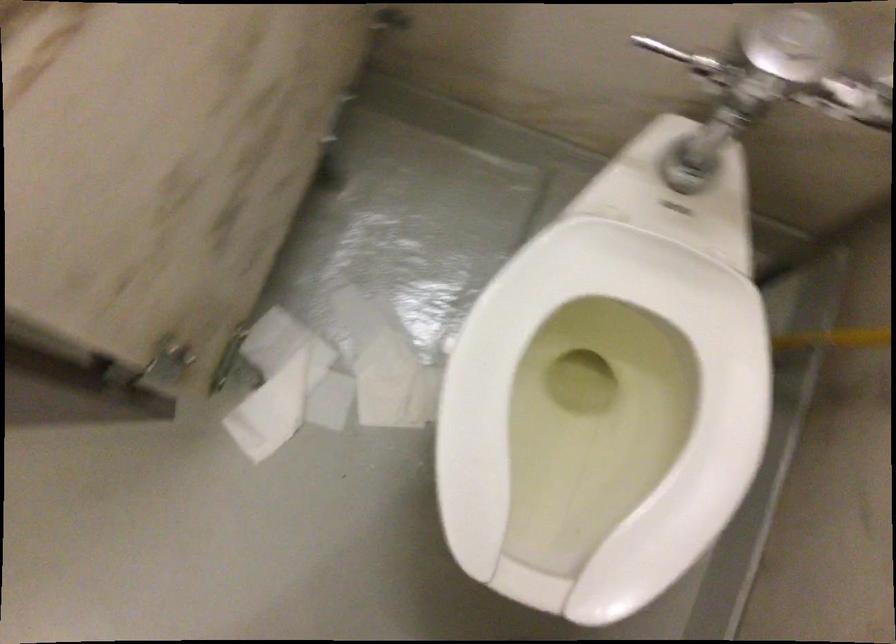
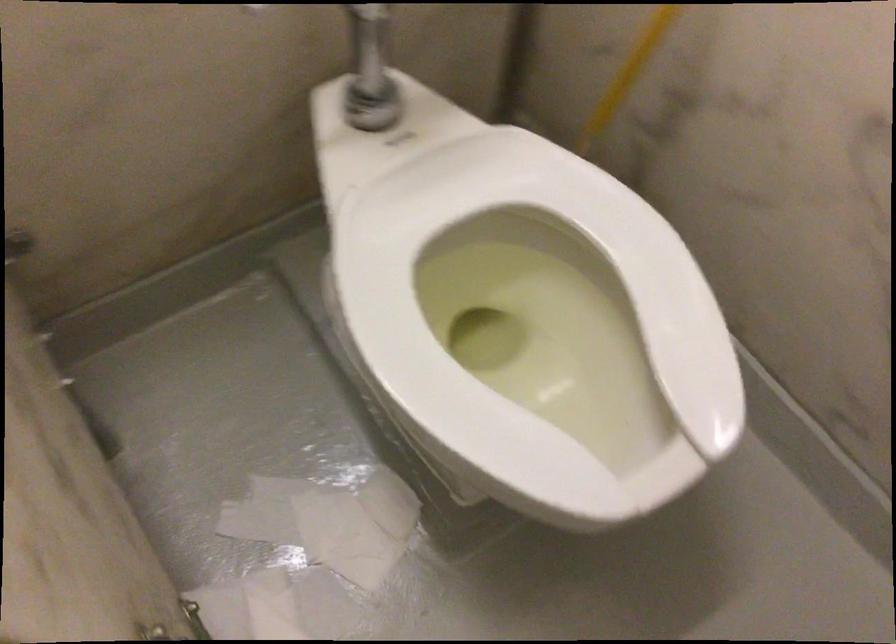
Find the pixel in the second image that matches [674,143] in the first image.

(362, 96)